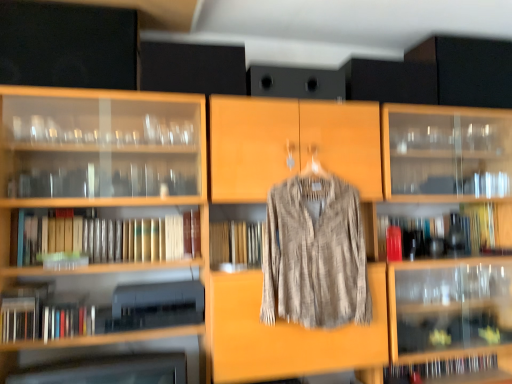
Question: Which direction should I rotate to look at wooden book at center, which ranks as the third book in right-to-left order, — up or down?

Choices:
 (A) up
 (B) down

Answer: (B)

Question: Is wooden book at center, which ranks as the third book in right-to-left order, looking in the opposite direction of hardcover book at lower right, acting as the second book starting from the right?

Choices:
 (A) no
 (B) yes

Answer: (A)

Question: Is wooden book at center, which is the 3th book in top-to-bottom order, closer to the viewer compared to hardcover book at lower right, arranged as the fourth book when viewed from the top?

Choices:
 (A) yes
 (B) no

Answer: (A)

Question: Is wooden book at center, which is the 3th book in top-to-bottom order, not within hardcover book at lower right, arranged as the fourth book when viewed from the top?

Choices:
 (A) yes
 (B) no

Answer: (A)

Question: Can you confirm if wooden book at center, placed as the second book when sorted from bottom to top, is positioned to the right of hardcover book at lower right, which ranks as the 3th book in left-to-right order?

Choices:
 (A) no
 (B) yes

Answer: (A)

Question: Does wooden book at center, placed as the second book when sorted from bottom to top, come behind hardcover book at lower right, arranged as the fourth book when viewed from the top?

Choices:
 (A) no
 (B) yes

Answer: (A)

Question: Is wooden book at center, which ranks as the third book in right-to-left order, far away from hardcover book at lower right, arranged as the fourth book when viewed from the top?

Choices:
 (A) no
 (B) yes

Answer: (B)

Question: Does yellow paperback book at right, the fourth book in the left-to-right sequence, have a smaller size compared to white paper book at center, arranged as the 4th book when viewed from the right?

Choices:
 (A) no
 (B) yes

Answer: (A)

Question: Is yellow paperback book at right, the 1th book when ordered from right to left, positioned in front of white paper book at center, which is the 3th book in bottom-to-top order?

Choices:
 (A) yes
 (B) no

Answer: (B)

Question: Is yellow paperback book at right, the 1th book when ordered from top to bottom, facing away from white paper book at center, which ranks as the 2th book in top-to-bottom order?

Choices:
 (A) no
 (B) yes

Answer: (A)

Question: From a real-world perspective, is yellow paperback book at right, the fourth book in the left-to-right sequence, positioned over white paper book at center, which ranks as the 2th book in top-to-bottom order, based on gravity?

Choices:
 (A) no
 (B) yes

Answer: (A)

Question: From the image's perspective, is yellow paperback book at right, the 1th book when ordered from top to bottom, below white paper book at center, the first book from the left?

Choices:
 (A) yes
 (B) no

Answer: (B)

Question: Does yellow paperback book at right, which is counted as the 4th book, starting from the bottom, have a larger size compared to white paper book at center, arranged as the 4th book when viewed from the right?

Choices:
 (A) no
 (B) yes

Answer: (B)

Question: Is textured beige shirt at center located outside wooden book at center, placed as the second book when sorted from bottom to top?

Choices:
 (A) yes
 (B) no

Answer: (A)